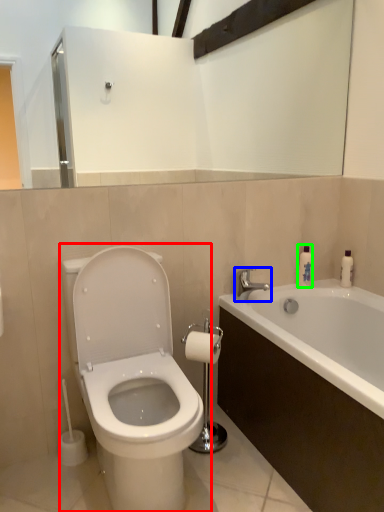
Question: Which is farther away from toilet (highlighted by a red box)? tap (highlighted by a blue box) or soap dispenser (highlighted by a green box)?

Choices:
 (A) tap
 (B) soap dispenser

Answer: (B)